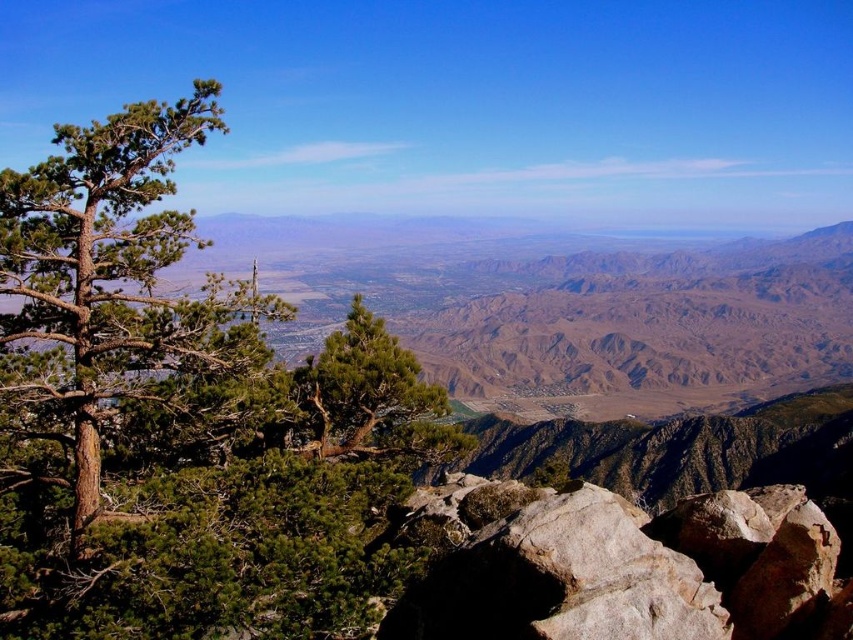
Question: Which point is closer to the camera taking this photo?

Choices:
 (A) (608, 525)
 (B) (62, 310)

Answer: (B)

Question: Can you confirm if green rough bark tree at left is positioned below gray rough rock at lower right?

Choices:
 (A) no
 (B) yes

Answer: (A)

Question: Does green rough bark tree at left appear under gray rough rock at lower right?

Choices:
 (A) no
 (B) yes

Answer: (A)

Question: Can you confirm if green rough bark tree at left is smaller than gray rough rock at lower right?

Choices:
 (A) no
 (B) yes

Answer: (A)